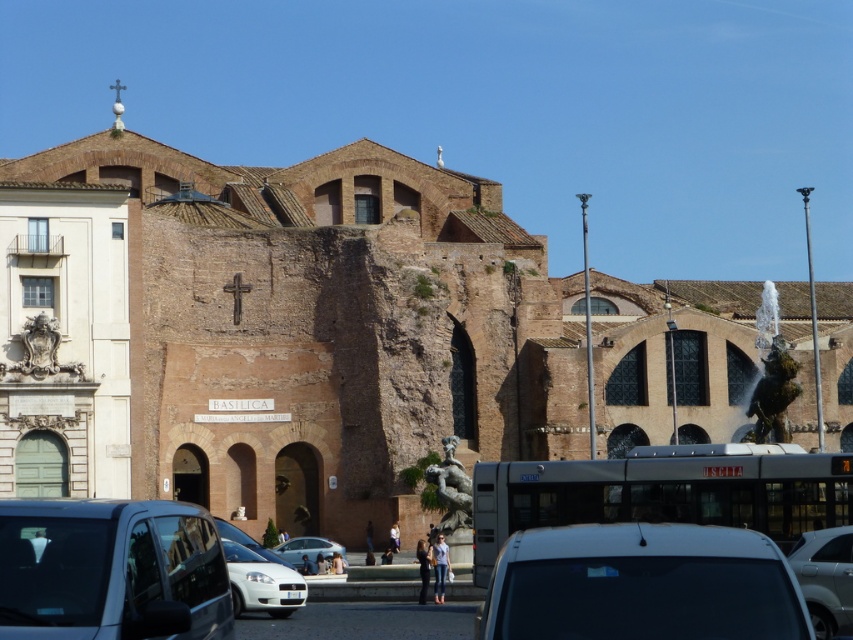
You are standing at the entrance of the basilica and want to park your car in the parking lot behind the silver metallic sedan at center. Can you determine the direction you should drive to reach the parking lot?

The silver metallic sedan at center is positioned at coordinates point (825, 577). Since the parking lot is behind it, you should drive in the direction away from the basilica towards the parking lot.